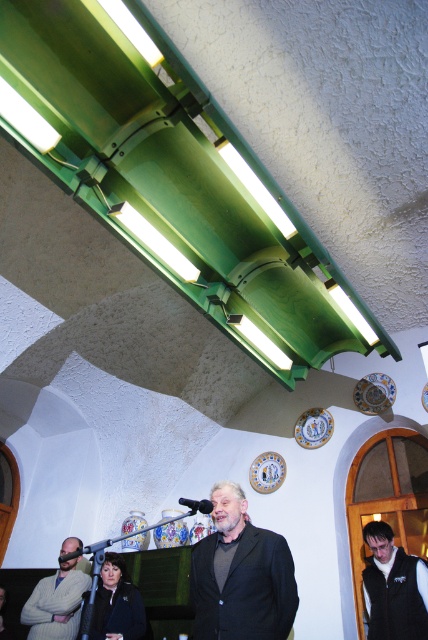
Question: Does black matte vest at lower right lie in front of black matte microphone at lower left?

Choices:
 (A) yes
 (B) no

Answer: (B)

Question: Which point appears farthest from the camera in this image?

Choices:
 (A) (68, 579)
 (B) (235, 497)
 (C) (401, 598)
 (D) (183, 499)

Answer: (A)

Question: Among these points, which one is nearest to the camera?

Choices:
 (A) (255, 556)
 (B) (59, 561)
 (C) (389, 637)
 (D) (184, 502)

Answer: (A)

Question: Which object is closer to the camera taking this photo?

Choices:
 (A) black matte microphone at lower left
 (B) dark gray suit at center
 (C) light gray sweater at lower left

Answer: (B)

Question: Is the position of dark gray suit at center less distant than that of black matte microphone at lower left?

Choices:
 (A) yes
 (B) no

Answer: (A)

Question: Is black matte microphone at lower center smaller than black matte microphone at lower left?

Choices:
 (A) no
 (B) yes

Answer: (B)